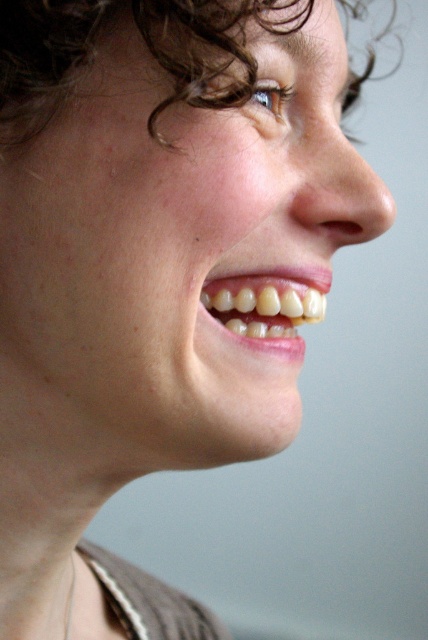
Question: Which is farther from the smooth skin face at center?

Choices:
 (A) silver metallic necklace at lower left
 (B) curly brown hair at upper center
 (C) natural white teeth at center

Answer: (A)

Question: Does natural white teeth at center have a smaller size compared to silver metallic necklace at lower left?

Choices:
 (A) no
 (B) yes

Answer: (A)

Question: Can you confirm if smooth skin face at center is positioned above silver metallic necklace at lower left?

Choices:
 (A) yes
 (B) no

Answer: (A)

Question: Which point is closer to the camera taking this photo?

Choices:
 (A) (71, 582)
 (B) (214, 292)

Answer: (B)

Question: Based on their relative distances, which object is nearer to the silver metallic necklace at lower left?

Choices:
 (A) curly brown hair at upper center
 (B) smooth skin face at center

Answer: (B)

Question: Is smooth skin face at center further to the viewer compared to silver metallic necklace at lower left?

Choices:
 (A) yes
 (B) no

Answer: (B)